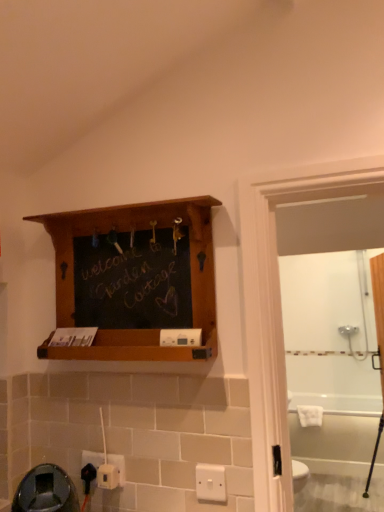
Where is `white plastic electric outlet at lower center, which is counted as the 3th electric outlet, starting from the back`? white plastic electric outlet at lower center, which is counted as the 3th electric outlet, starting from the back is located at coordinates (108, 476).

What do you see at coordinates (118, 466) in the screenshot? Image resolution: width=384 pixels, height=512 pixels. I see `white plastic electric outlet at lower left, the second electric outlet positioned from the front` at bounding box center [118, 466].

You are a GUI agent. You are given a task and a screenshot of the screen. Output one action in this format:
    pyautogui.click(x=<x>, y=<y>)
    Task: Click on the wooden shelf at upper center
    Image resolution: width=384 pixels, height=512 pixels.
    Given the screenshot: What is the action you would take?
    pyautogui.click(x=133, y=280)

Identify the location of white plastic/light switch at lower center. (210, 482).

Identify the location of white plastic electric outlet at lower center, which is counted as the 3th electric outlet, starting from the back. The image size is (384, 512). (108, 476).

Is white plastic electric outlet at lower left, the second electric outlet positioned from the front, in front of wooden shelf at upper center?

No, white plastic electric outlet at lower left, the second electric outlet positioned from the front, is behind wooden shelf at upper center.

Considering the sizes of objects white plastic electric outlet at lower left, the second electric outlet positioned from the front, and wooden shelf at upper center in the image provided, who is shorter, white plastic electric outlet at lower left, the second electric outlet positioned from the front, or wooden shelf at upper center?

With less height is white plastic electric outlet at lower left, the second electric outlet positioned from the front.

Find the location of a particular element. shelf above the white plastic electric outlet at lower left, the second electric outlet positioned from the front (from a real-world perspective) is located at coordinates 133,280.

Is white plastic electric outlet at lower left, the second electric outlet positioned from the front, bigger or smaller than wooden shelf at upper center?

white plastic electric outlet at lower left, the second electric outlet positioned from the front, is smaller than wooden shelf at upper center.

Does white plastic electric outlet at lower center, the 1th electric outlet viewed from the front, touch white plastic electric outlet at lower left, positioned as the 1th electric outlet in back-to-front order?

Absolutely, white plastic electric outlet at lower center, the 1th electric outlet viewed from the front, is next to and touching white plastic electric outlet at lower left, positioned as the 1th electric outlet in back-to-front order.

From a real-world perspective, is white plastic electric outlet at lower center, which is counted as the 3th electric outlet, starting from the back, located beneath white plastic electric outlet at lower left, positioned as the 1th electric outlet in back-to-front order?

Actually, white plastic electric outlet at lower center, which is counted as the 3th electric outlet, starting from the back, is physically above white plastic electric outlet at lower left, positioned as the 1th electric outlet in back-to-front order, in the real world.

From the image's perspective, who appears lower, white plastic electric outlet at lower center, the 1th electric outlet viewed from the front, or white glossy bathtub at lower right?

white glossy bathtub at lower right appears lower in the image.

Considering their positions, is white plastic electric outlet at lower center, which is counted as the 3th electric outlet, starting from the back, located in front of or behind white glossy bathtub at lower right?

Visually, white plastic electric outlet at lower center, which is counted as the 3th electric outlet, starting from the back, is located in front of white glossy bathtub at lower right.

Locate an element on the screen. The height and width of the screenshot is (512, 384). bath behind the white plastic electric outlet at lower center, which is counted as the 3th electric outlet, starting from the back is located at coordinates (334, 434).

Considering the relative sizes of white plastic electric outlet at lower center, which is counted as the 3th electric outlet, starting from the back, and white glossy bathtub at lower right in the image provided, is white plastic electric outlet at lower center, which is counted as the 3th electric outlet, starting from the back, shorter than white glossy bathtub at lower right?

Yes.

Is the surface of white plastic electric outlet at lower center, the 1th electric outlet viewed from the front, in direct contact with white plastic electric outlet at lower left, the second electric outlet positioned from the front?

Yes, white plastic electric outlet at lower center, the 1th electric outlet viewed from the front, is with white plastic electric outlet at lower left, the second electric outlet positioned from the front.

From the image's perspective, who appears lower, white plastic electric outlet at lower center, which is counted as the 3th electric outlet, starting from the back, or white plastic electric outlet at lower left, the second electric outlet positioned from the front?

white plastic electric outlet at lower center, which is counted as the 3th electric outlet, starting from the back, appears lower in the image.

In the image, is white plastic electric outlet at lower center, the 1th electric outlet viewed from the front, positioned in front of or behind white plastic electric outlet at lower left, the second electric outlet positioned from the front?

In the image, white plastic electric outlet at lower center, the 1th electric outlet viewed from the front, appears in front of white plastic electric outlet at lower left, the second electric outlet positioned from the front.

Does wooden shelf at upper center touch white plastic/light switch at lower center?

No.

How many degrees apart are the facing directions of wooden shelf at upper center and white plastic/light switch at lower center?

The angle between the facing direction of wooden shelf at upper center and the facing direction of white plastic/light switch at lower center is 4.84 degrees.

Is wooden shelf at upper center shorter than white plastic/light switch at lower center?

No.

In the image, there is a wooden shelf at upper center. Where is `light switch below it (from the image's perspective)`? light switch below it (from the image's perspective) is located at coordinates (210, 482).

Is white plastic electric outlet at lower left, the second electric outlet positioned from the front, not within white glossy bathtub at lower right?

Indeed, white plastic electric outlet at lower left, the second electric outlet positioned from the front, is completely outside white glossy bathtub at lower right.

Is white plastic electric outlet at lower left, placed as the second electric outlet when sorted from back to front, far away from white glossy bathtub at lower right?

Yes, white plastic electric outlet at lower left, placed as the second electric outlet when sorted from back to front, and white glossy bathtub at lower right are quite far apart.

Measure the distance between white plastic electric outlet at lower left, placed as the second electric outlet when sorted from back to front, and white glossy bathtub at lower right.

white plastic electric outlet at lower left, placed as the second electric outlet when sorted from back to front, is 3.08 meters from white glossy bathtub at lower right.

In the scene shown: Which point is more distant from viewer, (117, 456) or (354, 439)?

The point (354, 439) is behind.

Which is in front, white glossy bathtub at lower right or white plastic electric outlet at lower left, the 3th electric outlet viewed from the front?

white plastic electric outlet at lower left, the 3th electric outlet viewed from the front.

Which of these two, white glossy bathtub at lower right or white plastic electric outlet at lower left, positioned as the 1th electric outlet in back-to-front order, is wider?

white glossy bathtub at lower right is wider.

Is white glossy bathtub at lower right positioned beyond the bounds of white plastic electric outlet at lower left, the 3th electric outlet viewed from the front?

Indeed, white glossy bathtub at lower right is completely outside white plastic electric outlet at lower left, the 3th electric outlet viewed from the front.

From the wooden shelf at upper center, count the 2nd electric outlet to the left and point to it. Please provide its 2D coordinates.

[(118, 466)]

Identify the location of the 1st electric outlet located above the white plastic electric outlet at lower left, positioned as the 1th electric outlet in back-to-front order (from a real-world perspective). (108, 476).

Looking at this image, which object lies nearer to the anchor point white plastic/light switch at lower center, white glossy bathtub at lower right or white plastic electric outlet at lower center, the 1th electric outlet viewed from the front?

white plastic electric outlet at lower center, the 1th electric outlet viewed from the front.

Looking at the image, which one is located closer to wooden shelf at upper center, white plastic electric outlet at lower left, positioned as the 1th electric outlet in back-to-front order, or white plastic electric outlet at lower left, placed as the second electric outlet when sorted from back to front?

white plastic electric outlet at lower left, placed as the second electric outlet when sorted from back to front, lies closer to wooden shelf at upper center than the other object.

Estimate the real-world distances between objects in this image. Which object is closer to wooden shelf at upper center, white glossy bathtub at lower right or white plastic electric outlet at lower left, positioned as the 1th electric outlet in back-to-front order?

white plastic electric outlet at lower left, positioned as the 1th electric outlet in back-to-front order, lies closer to wooden shelf at upper center than the other object.

Estimate the real-world distances between objects in this image. Which object is closer to white plastic electric outlet at lower center, which is counted as the 3th electric outlet, starting from the back, white plastic electric outlet at lower left, placed as the second electric outlet when sorted from back to front, or white glossy bathtub at lower right?

white plastic electric outlet at lower left, placed as the second electric outlet when sorted from back to front, is positioned closer to the anchor white plastic electric outlet at lower center, which is counted as the 3th electric outlet, starting from the back.

When comparing their distances from white plastic/light switch at lower center, does white plastic electric outlet at lower left, positioned as the 1th electric outlet in back-to-front order, or white glossy bathtub at lower right seem further?

white glossy bathtub at lower right.

When comparing their distances from white glossy bathtub at lower right, does white plastic electric outlet at lower left, positioned as the 1th electric outlet in back-to-front order, or white plastic electric outlet at lower left, the second electric outlet positioned from the front, seem closer?

white plastic electric outlet at lower left, the second electric outlet positioned from the front, lies closer to white glossy bathtub at lower right than the other object.

Which object lies nearer to the anchor point white glossy bathtub at lower right, white plastic electric outlet at lower left, positioned as the 1th electric outlet in back-to-front order, or wooden shelf at upper center?

white plastic electric outlet at lower left, positioned as the 1th electric outlet in back-to-front order, is closer to white glossy bathtub at lower right.

Based on their spatial positions, is wooden shelf at upper center or white plastic electric outlet at lower center, which is counted as the 3th electric outlet, starting from the back, further from white plastic/light switch at lower center?

wooden shelf at upper center is further to white plastic/light switch at lower center.

Identify the location of electric outlet between white plastic electric outlet at lower left, the second electric outlet positioned from the front, and white plastic/light switch at lower center. This screenshot has height=512, width=384. (108, 476).

In order to click on electric outlet located between white plastic electric outlet at lower left, positioned as the 1th electric outlet in back-to-front order, and white plastic electric outlet at lower center, which is counted as the 3th electric outlet, starting from the back, in the left-right direction in this screenshot , I will do `click(118, 466)`.

This screenshot has width=384, height=512. Identify the location of light switch positioned between wooden shelf at upper center and white glossy bathtub at lower right from near to far. (210, 482).

The width and height of the screenshot is (384, 512). I want to click on light switch between wooden shelf at upper center and white plastic electric outlet at lower left, the second electric outlet positioned from the front, in the up-down direction, so click(210, 482).